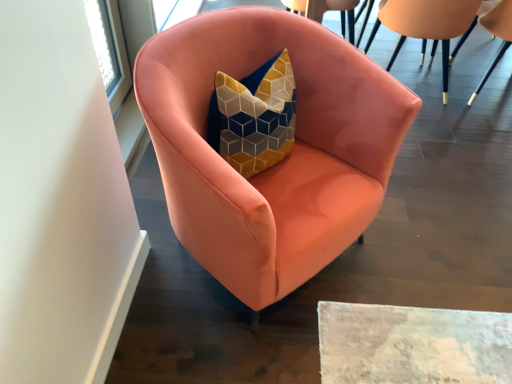
What do you see at coordinates (493, 34) in the screenshot? I see `matte pink armchair at upper right, marked as the 1th chair in a right-to-left arrangement` at bounding box center [493, 34].

This screenshot has width=512, height=384. What do you see at coordinates (281, 161) in the screenshot?
I see `matte pink armchair at center, which is the 1th chair from left to right` at bounding box center [281, 161].

You are a GUI agent. You are given a task and a screenshot of the screen. Output one action in this format:
    pyautogui.click(x=<x>, y=<y>)
    Task: Click on the matte pink armchair at center, which is the 1th chair from left to right
    This screenshot has width=512, height=384.
    Given the screenshot: What is the action you would take?
    pos(281,161)

Locate an element on the screen. This screenshot has height=384, width=512. matte pink armchair at upper right, which ranks as the 3th chair in left-to-right order is located at coordinates (493, 34).

Is matte pink armchair at upper right, which ranks as the 3th chair in left-to-right order, thinner than matte pink armchair at center, the 3th chair when ordered from right to left?

Yes.

From the image's perspective, does matte pink armchair at upper right, which ranks as the 3th chair in left-to-right order, appear higher than matte pink armchair at center, the 3th chair when ordered from right to left?

Yes, from the image's perspective, matte pink armchair at upper right, which ranks as the 3th chair in left-to-right order, is on top of matte pink armchair at center, the 3th chair when ordered from right to left.

Based on their sizes in the image, would you say matte pink armchair at upper right, marked as the 1th chair in a right-to-left arrangement, is bigger or smaller than matte pink armchair at center, which is the 1th chair from left to right?

In the image, matte pink armchair at upper right, marked as the 1th chair in a right-to-left arrangement, appears to be smaller than matte pink armchair at center, which is the 1th chair from left to right.

Between point (456, 8) and point (468, 104), which one is positioned behind?

The point (468, 104) is farther from the camera.

Can you confirm if matte pink armchair at upper right, the 2th chair in the left-to-right sequence, is wider than matte pink armchair at upper right, which ranks as the 3th chair in left-to-right order?

Correct, the width of matte pink armchair at upper right, the 2th chair in the left-to-right sequence, exceeds that of matte pink armchair at upper right, which ranks as the 3th chair in left-to-right order.

Between matte pink armchair at upper right, the 2th chair in the left-to-right sequence, and matte pink armchair at upper right, marked as the 1th chair in a right-to-left arrangement, which one appears on the left side from the viewer's perspective?

From the viewer's perspective, matte pink armchair at upper right, the 2th chair in the left-to-right sequence, appears more on the left side.

Does matte pink armchair at upper right, the 2th chair in the left-to-right sequence, turn towards matte pink armchair at upper right, which ranks as the 3th chair in left-to-right order?

No, matte pink armchair at upper right, the 2th chair in the left-to-right sequence, is not oriented towards matte pink armchair at upper right, which ranks as the 3th chair in left-to-right order.

How different are the orientations of matte pink armchair at center, which is the 1th chair from left to right, and matte pink armchair at upper right, which ranks as the 3th chair in left-to-right order, in degrees?

137 degrees.

Is matte pink armchair at center, which is the 1th chair from left to right, to the left or to the right of matte pink armchair at upper right, which ranks as the 3th chair in left-to-right order, in the image?

Clearly, matte pink armchair at center, which is the 1th chair from left to right, is on the left of matte pink armchair at upper right, which ranks as the 3th chair in left-to-right order, in the image.

From a real-world perspective, which is physically below, matte pink armchair at center, which is the 1th chair from left to right, or matte pink armchair at upper right, which ranks as the 3th chair in left-to-right order?

From a 3D spatial view, matte pink armchair at upper right, which ranks as the 3th chair in left-to-right order, is below.

How different are the orientations of matte pink armchair at center, which is the 1th chair from left to right, and matte pink armchair at upper right, the 2th chair in the left-to-right sequence, in degrees?

The angle between the facing direction of matte pink armchair at center, which is the 1th chair from left to right, and the facing direction of matte pink armchair at upper right, the 2th chair in the left-to-right sequence, is 134 degrees.

Based on the photo, is the position of matte pink armchair at center, the 3th chair when ordered from right to left, less distant than that of matte pink armchair at upper right, the 2th chair in the left-to-right sequence?

Yes, the depth of matte pink armchair at center, the 3th chair when ordered from right to left, is less than that of matte pink armchair at upper right, the 2th chair in the left-to-right sequence.

Which object is positioned more to the left, matte pink armchair at center, which is the 1th chair from left to right, or matte pink armchair at upper right, the second chair from the right?

matte pink armchair at center, which is the 1th chair from left to right, is more to the left.

Is matte pink armchair at center, which is the 1th chair from left to right, facing towards matte pink armchair at upper right, the second chair from the right?

No, matte pink armchair at center, which is the 1th chair from left to right, does not turn towards matte pink armchair at upper right, the second chair from the right.

How far apart are matte pink armchair at upper right, which ranks as the 3th chair in left-to-right order, and matte pink armchair at upper right, the second chair from the right?

matte pink armchair at upper right, which ranks as the 3th chair in left-to-right order, and matte pink armchair at upper right, the second chair from the right, are 11.43 inches apart from each other.

Considering the sizes of matte pink armchair at upper right, marked as the 1th chair in a right-to-left arrangement, and matte pink armchair at upper right, the 2th chair in the left-to-right sequence, in the image, is matte pink armchair at upper right, marked as the 1th chair in a right-to-left arrangement, taller or shorter than matte pink armchair at upper right, the 2th chair in the left-to-right sequence,?

Clearly, matte pink armchair at upper right, marked as the 1th chair in a right-to-left arrangement, is shorter compared to matte pink armchair at upper right, the 2th chair in the left-to-right sequence.

Between matte pink armchair at upper right, marked as the 1th chair in a right-to-left arrangement, and matte pink armchair at upper right, the second chair from the right, which one has larger width?

With larger width is matte pink armchair at upper right, the second chair from the right.

In the scene shown: Is matte pink armchair at upper right, the 2th chair in the left-to-right sequence, inside matte pink armchair at upper right, which ranks as the 3th chair in left-to-right order?

That's incorrect, matte pink armchair at upper right, the 2th chair in the left-to-right sequence, is not inside matte pink armchair at upper right, which ranks as the 3th chair in left-to-right order.

Is point (413, 22) more distant than point (378, 100)?

Yes, it is.

Which is more to the left, matte pink armchair at upper right, the 2th chair in the left-to-right sequence, or matte pink armchair at center, which is the 1th chair from left to right?

matte pink armchair at center, which is the 1th chair from left to right.

Considering the sizes of matte pink armchair at upper right, the 2th chair in the left-to-right sequence, and matte pink armchair at center, which is the 1th chair from left to right, in the image, is matte pink armchair at upper right, the 2th chair in the left-to-right sequence, taller or shorter than matte pink armchair at center, which is the 1th chair from left to right,?

matte pink armchair at upper right, the 2th chair in the left-to-right sequence, is shorter than matte pink armchair at center, which is the 1th chair from left to right.

This screenshot has height=384, width=512. What are the coordinates of `chair below the matte pink armchair at upper right, which ranks as the 3th chair in left-to-right order (from the image's perspective)` in the screenshot? It's located at (281, 161).

From the matte pink armchair at upper right, which ranks as the 3th chair in left-to-right order, count 1st chairs forward and point to it. Please provide its 2D coordinates.

[(426, 25)]

Estimate the real-world distances between objects in this image. Which object is further from matte pink armchair at upper right, which ranks as the 3th chair in left-to-right order, matte pink armchair at upper right, the second chair from the right, or matte pink armchair at center, which is the 1th chair from left to right?

matte pink armchair at center, which is the 1th chair from left to right, is positioned further to the anchor matte pink armchair at upper right, which ranks as the 3th chair in left-to-right order.

When comparing their distances from matte pink armchair at upper right, the second chair from the right, does matte pink armchair at upper right, marked as the 1th chair in a right-to-left arrangement, or matte pink armchair at center, which is the 1th chair from left to right, seem closer?

matte pink armchair at upper right, marked as the 1th chair in a right-to-left arrangement, is positioned closer to the anchor matte pink armchair at upper right, the second chair from the right.

Which object lies further to the anchor point matte pink armchair at upper right, which ranks as the 3th chair in left-to-right order, matte pink armchair at center, the 3th chair when ordered from right to left, or matte pink armchair at upper right, the 2th chair in the left-to-right sequence?

matte pink armchair at center, the 3th chair when ordered from right to left.

Estimate the real-world distances between objects in this image. Which object is closer to matte pink armchair at center, which is the 1th chair from left to right, matte pink armchair at upper right, the second chair from the right, or matte pink armchair at upper right, marked as the 1th chair in a right-to-left arrangement?

matte pink armchair at upper right, the second chair from the right, lies closer to matte pink armchair at center, which is the 1th chair from left to right, than the other object.

Which object lies nearer to the anchor point matte pink armchair at center, which is the 1th chair from left to right, matte pink armchair at upper right, marked as the 1th chair in a right-to-left arrangement, or matte pink armchair at upper right, the second chair from the right?

matte pink armchair at upper right, the second chair from the right, is closer to matte pink armchair at center, which is the 1th chair from left to right.

From the picture: Looking at the image, which one is located further to matte pink armchair at upper right, the 2th chair in the left-to-right sequence, matte pink armchair at center, the 3th chair when ordered from right to left, or matte pink armchair at upper right, marked as the 1th chair in a right-to-left arrangement?

matte pink armchair at center, the 3th chair when ordered from right to left, is positioned further to the anchor matte pink armchair at upper right, the 2th chair in the left-to-right sequence.

Locate an element on the screen. The height and width of the screenshot is (384, 512). chair located between matte pink armchair at center, the 3th chair when ordered from right to left, and matte pink armchair at upper right, marked as the 1th chair in a right-to-left arrangement, in the left-right direction is located at coordinates (426, 25).